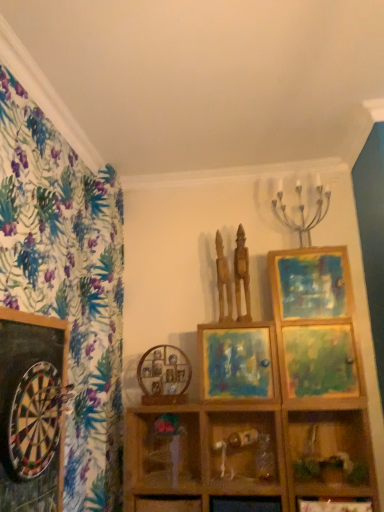
Image resolution: width=384 pixels, height=512 pixels. Describe the element at coordinates (162, 450) in the screenshot. I see `wooden vase at center` at that location.

Locate an element on the screen. The width and height of the screenshot is (384, 512). wooden at center, marked as the 1th shelf in a left-to-right arrangement is located at coordinates (201, 456).

Image resolution: width=384 pixels, height=512 pixels. Describe the element at coordinates (238, 362) in the screenshot. I see `matte wooden picture frame at center, which ranks as the first picture frame in right-to-left order` at that location.

Image resolution: width=384 pixels, height=512 pixels. I want to click on wooden figurine at center, which is the second shelf in right-to-left order, so click(243, 452).

Identify the location of wooden statue at upper center, arranged as the 1th sculpture when viewed from the left. The image size is (384, 512). (223, 279).

This screenshot has width=384, height=512. Identify the location of wooden statue at upper center, the 1th sculpture viewed from the right. tap(242, 274).

The height and width of the screenshot is (512, 384). I want to click on wooden vase at center, so click(162, 450).

From the image's perspective, relative to wooden statue at upper center, the 1th sculpture viewed from the right, is wooden dartboard at left, positioned as the 1th picture frame in front-to-back order, above or below?

Based on their image positions, wooden dartboard at left, positioned as the 1th picture frame in front-to-back order, is located beneath wooden statue at upper center, the 1th sculpture viewed from the right.

Considering the sizes of objects wooden dartboard at left, the third picture frame when ordered from right to left, and wooden statue at upper center, the 1th sculpture viewed from the right, in the image provided, who is wider, wooden dartboard at left, the third picture frame when ordered from right to left, or wooden statue at upper center, the 1th sculpture viewed from the right,?

wooden statue at upper center, the 1th sculpture viewed from the right.

Starting from the wooden statue at upper center, the 1th sculpture viewed from the right, which picture frame is the 3rd one to the left? Please provide its 2D coordinates.

[(17, 401)]

Is wooden dartboard at left, placed as the 1th picture frame when sorted from left to right, bigger or smaller than wooden statue at upper center, the 1th sculpture viewed from the right?

wooden dartboard at left, placed as the 1th picture frame when sorted from left to right, is bigger than wooden statue at upper center, the 1th sculpture viewed from the right.

Could you measure the distance between wooden dartboard at left, the third picture frame when ordered from right to left, and wooden figurine at center, which is the second shelf in right-to-left order?

wooden dartboard at left, the third picture frame when ordered from right to left, is 37.87 inches away from wooden figurine at center, which is the second shelf in right-to-left order.

Where is `picture frame in front of the wooden figurine at center, which is counted as the second shelf, starting from the left`? The width and height of the screenshot is (384, 512). picture frame in front of the wooden figurine at center, which is counted as the second shelf, starting from the left is located at coordinates (17, 401).

In the image, is wooden dartboard at left, placed as the 1th picture frame when sorted from left to right, positioned in front of or behind wooden figurine at center, which is the second shelf in right-to-left order?

wooden dartboard at left, placed as the 1th picture frame when sorted from left to right, is in front of wooden figurine at center, which is the second shelf in right-to-left order.

Does wooden dartboard at left, positioned as the 1th picture frame in front-to-back order, have a greater height compared to wooden figurine at center, which is the second shelf in right-to-left order?

Yes, wooden dartboard at left, positioned as the 1th picture frame in front-to-back order, is taller than wooden figurine at center, which is the second shelf in right-to-left order.

From a real-world perspective, starting from the wooden shelf at lower right, marked as the third shelf in a left-to-right arrangement, which picture frame is the 2nd one vertically above it? Please provide its 2D coordinates.

[(164, 372)]

Considering the positions of point (155, 378) and point (360, 492), is point (155, 378) closer or farther from the camera than point (360, 492)?

Clearly, point (155, 378) is more distant from the camera than point (360, 492).

Does wooden picture frame at center, which is the first picture frame in back-to-front order, turn towards wooden shelf at lower right, marked as the third shelf in a left-to-right arrangement?

No, wooden picture frame at center, which is the first picture frame in back-to-front order, is not turned towards wooden shelf at lower right, marked as the third shelf in a left-to-right arrangement.

From a real-world perspective, is wooden picture frame at center, which is the first picture frame in back-to-front order, physically located above or below wooden shelf at lower right, which is the first shelf in right-to-left order?

wooden picture frame at center, which is the first picture frame in back-to-front order, is above wooden shelf at lower right, which is the first shelf in right-to-left order.

Between wooden vase at center and metallic silver candle holder at upper right, which one appears on the left side from the viewer's perspective?

Positioned to the left is wooden vase at center.

Would you say wooden vase at center is inside or outside metallic silver candle holder at upper right?

wooden vase at center is located beyond the bounds of metallic silver candle holder at upper right.

Is wooden vase at center aimed at metallic silver candle holder at upper right?

No, wooden vase at center is not turned towards metallic silver candle holder at upper right.

Is wooden vase at center thinner than metallic silver candle holder at upper right?

Indeed, wooden vase at center has a lesser width compared to metallic silver candle holder at upper right.

Which is behind, wooden dartboard at left, placed as the 1th picture frame when sorted from left to right, or metallic silver candle holder at upper right?

metallic silver candle holder at upper right is further away from the camera.

Is wooden dartboard at left, positioned as the 1th picture frame in front-to-back order, located outside metallic silver candle holder at upper right?

wooden dartboard at left, positioned as the 1th picture frame in front-to-back order, is positioned outside metallic silver candle holder at upper right.

The height and width of the screenshot is (512, 384). What are the coordinates of `candle holder positioned vertically above the wooden dartboard at left, placed as the 1th picture frame when sorted from left to right (from a real-world perspective)` in the screenshot? It's located at (303, 210).

Based on the photo, how distant is wooden dartboard at left, positioned as the 1th picture frame in front-to-back order, from metallic silver candle holder at upper right?

wooden dartboard at left, positioned as the 1th picture frame in front-to-back order, is 5.66 feet from metallic silver candle holder at upper right.

From the image's perspective, which is above, wooden at center, arranged as the 3th shelf when viewed from the right, or matte wooden picture frame at center, which ranks as the first picture frame in right-to-left order?

matte wooden picture frame at center, which ranks as the first picture frame in right-to-left order, is shown above in the image.

Considering the points (146, 450) and (268, 342), which point is behind, point (146, 450) or point (268, 342)?

The point (146, 450) is farther from the camera.

From a real-world perspective, which is physically above, wooden at center, marked as the 1th shelf in a left-to-right arrangement, or matte wooden picture frame at center, the 3th picture frame positioned from the left?

matte wooden picture frame at center, the 3th picture frame positioned from the left.

Consider the image. Does wooden at center, marked as the 1th shelf in a left-to-right arrangement, have a greater width compared to matte wooden picture frame at center, which ranks as the first picture frame in right-to-left order?

Yes, wooden at center, marked as the 1th shelf in a left-to-right arrangement, is wider than matte wooden picture frame at center, which ranks as the first picture frame in right-to-left order.

How many degrees apart are the facing directions of wooden at center, arranged as the 3th shelf when viewed from the right, and wooden figurine at center, which is the second shelf in right-to-left order?

46.9 degrees.

Is wooden figurine at center, which is the second shelf in right-to-left order, at the back of wooden at center, arranged as the 3th shelf when viewed from the right?

That's right, wooden at center, arranged as the 3th shelf when viewed from the right, is facing away from wooden figurine at center, which is the second shelf in right-to-left order.

Is wooden at center, arranged as the 3th shelf when viewed from the right, far from wooden figurine at center, which is the second shelf in right-to-left order?

They are positioned close to each other.

From the image's perspective, between wooden at center, arranged as the 3th shelf when viewed from the right, and wooden figurine at center, which is the second shelf in right-to-left order, who is located below?

wooden at center, arranged as the 3th shelf when viewed from the right, appears lower in the image.

This screenshot has height=512, width=384. Identify the location of the 3rd picture frame to the left of the wooden statue at upper center, marked as the 2th sculpture in a left-to-right arrangement, counting from the anchor's position. (17, 401).

Where is `shelf that is the 2nd object to the right of the wooden dartboard at left, positioned as the 1th picture frame in front-to-back order, starting at the anchor`? This screenshot has height=512, width=384. shelf that is the 2nd object to the right of the wooden dartboard at left, positioned as the 1th picture frame in front-to-back order, starting at the anchor is located at coordinates (243, 452).

Looking at this image, looking at the image, which one is located closer to wooden vase at center, wooden picture frame at center, which is the first picture frame in back-to-front order, or wooden shelf at lower right, marked as the third shelf in a left-to-right arrangement?

wooden picture frame at center, which is the first picture frame in back-to-front order, is positioned closer to the anchor wooden vase at center.

In the scene shown: When comparing their distances from wooden shelf at lower right, which is the first shelf in right-to-left order, does wooden picture frame at center, which ranks as the 2th picture frame in left-to-right order, or wooden dartboard at left, placed as the 1th picture frame when sorted from left to right, seem further?

wooden dartboard at left, placed as the 1th picture frame when sorted from left to right, lies further to wooden shelf at lower right, which is the first shelf in right-to-left order, than the other object.

Looking at the image, which one is located closer to wooden statue at upper center, arranged as the 1th sculpture when viewed from the left, wooden at center, marked as the 1th shelf in a left-to-right arrangement, or metallic silver candle holder at upper right?

Among the two, metallic silver candle holder at upper right is located nearer to wooden statue at upper center, arranged as the 1th sculpture when viewed from the left.

Looking at this image, considering their positions, is wooden picture frame at center, which ranks as the 2th picture frame in left-to-right order, positioned further to metallic silver candle holder at upper right than wooden shelf at lower right, marked as the third shelf in a left-to-right arrangement?

wooden shelf at lower right, marked as the third shelf in a left-to-right arrangement.

From the image, which object appears to be nearer to wooden at center, arranged as the 3th shelf when viewed from the right, wooden figurine at center, which is the second shelf in right-to-left order, or wooden statue at upper center, positioned as the 2th sculpture in right-to-left order?

wooden figurine at center, which is the second shelf in right-to-left order, is positioned closer to the anchor wooden at center, arranged as the 3th shelf when viewed from the right.

Which object lies further to the anchor point wooden shelf at lower right, which is the first shelf in right-to-left order, wooden vase at center or wooden at center, marked as the 1th shelf in a left-to-right arrangement?

wooden vase at center.

Estimate the real-world distances between objects in this image. Which object is further from metallic silver candle holder at upper right, wooden dartboard at left, positioned as the 1th picture frame in front-to-back order, or wooden figurine at center, which is the second shelf in right-to-left order?

The object further to metallic silver candle holder at upper right is wooden dartboard at left, positioned as the 1th picture frame in front-to-back order.

When comparing their distances from wooden statue at upper center, positioned as the 2th sculpture in right-to-left order, does wooden figurine at center, which is the second shelf in right-to-left order, or wooden statue at upper center, the 1th sculpture viewed from the right, seem further?

wooden figurine at center, which is the second shelf in right-to-left order, lies further to wooden statue at upper center, positioned as the 2th sculpture in right-to-left order, than the other object.

The image size is (384, 512). In order to click on cabinet between metallic silver candle holder at upper right and wooden shelf at lower right, marked as the third shelf in a left-to-right arrangement, from top to bottom in this screenshot , I will do `click(162, 450)`.

Find the location of `shelf between wooden at center, arranged as the 3th shelf when viewed from the right, and wooden shelf at lower right, marked as the third shelf in a left-to-right arrangement`. shelf between wooden at center, arranged as the 3th shelf when viewed from the right, and wooden shelf at lower right, marked as the third shelf in a left-to-right arrangement is located at coordinates (243, 452).

Image resolution: width=384 pixels, height=512 pixels. I want to click on shelf between wooden statue at upper center, arranged as the 1th sculpture when viewed from the left, and wooden shelf at lower right, which is the first shelf in right-to-left order, from top to bottom, so click(x=243, y=452).

Where is `shelf between wooden statue at upper center, the 1th sculpture viewed from the right, and wooden shelf at lower right, marked as the third shelf in a left-to-right arrangement, vertically`? shelf between wooden statue at upper center, the 1th sculpture viewed from the right, and wooden shelf at lower right, marked as the third shelf in a left-to-right arrangement, vertically is located at coordinates (243, 452).